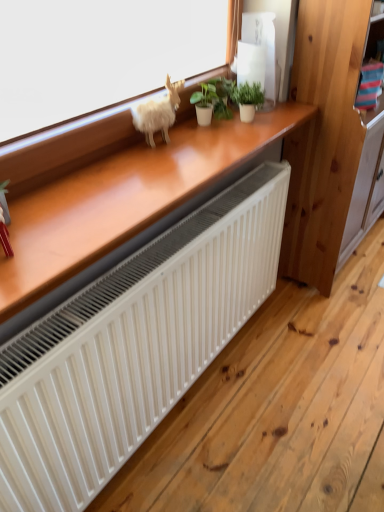
In order to face green matte plant at upper center, marked as the 2th houseplant in a left-to-right arrangement, should I rotate leftwards or rightwards?

Turn right by 7.481 degrees to look at green matte plant at upper center, marked as the 2th houseplant in a left-to-right arrangement.

This screenshot has height=512, width=384. I want to click on fuzzy white animal at upper center, so click(158, 113).

Image resolution: width=384 pixels, height=512 pixels. I want to click on green matte plant at center, arranged as the first houseplant when viewed from the left, so click(x=214, y=97).

In order to face wooden dresser at right, should I rotate leftwards or rightwards?

Rotate right and turn 21.163 degrees.

You are a GUI agent. You are given a task and a screenshot of the screen. Output one action in this format:
    pyautogui.click(x=<x>, y=<y>)
    Task: Click on the white matte radiator at lower center
    
    Given the screenshot: What is the action you would take?
    pyautogui.click(x=133, y=346)

How much distance is there between white matte radiator at lower center and green matte plant at center, arranged as the first houseplant when viewed from the left?

A distance of 26.35 inches exists between white matte radiator at lower center and green matte plant at center, arranged as the first houseplant when viewed from the left.

Would you say white matte radiator at lower center contains green matte plant at center, the second houseplant when ordered from right to left?

No, white matte radiator at lower center does not contain green matte plant at center, the second houseplant when ordered from right to left.

Is white matte radiator at lower center smaller than green matte plant at center, arranged as the first houseplant when viewed from the left?

No.

How different are the orientations of white matte radiator at lower center and green matte plant at center, arranged as the first houseplant when viewed from the left, in degrees?

There is a 0.506-degree angle between the facing directions of white matte radiator at lower center and green matte plant at center, arranged as the first houseplant when viewed from the left.

Which is more to the right, fuzzy white animal at upper center or green matte plant at upper center, marked as the 2th houseplant in a left-to-right arrangement?

green matte plant at upper center, marked as the 2th houseplant in a left-to-right arrangement, is more to the right.

Which is less distant, (169, 92) or (262, 98)?

Answer: Point (169, 92) is positioned closer to the camera compared to point (262, 98).

Is fuzzy white animal at upper center thinner than green matte plant at upper center, placed as the first houseplant when sorted from right to left?

Correct, the width of fuzzy white animal at upper center is less than that of green matte plant at upper center, placed as the first houseplant when sorted from right to left.

Considering the relative sizes of green matte plant at center, the second houseplant when ordered from right to left, and fuzzy white animal at upper center in the image provided, is green matte plant at center, the second houseplant when ordered from right to left, shorter than fuzzy white animal at upper center?

Yes, green matte plant at center, the second houseplant when ordered from right to left, is shorter than fuzzy white animal at upper center.

From a real-world perspective, does green matte plant at center, the second houseplant when ordered from right to left, stand above fuzzy white animal at upper center?

No, from a real-world perspective, green matte plant at center, the second houseplant when ordered from right to left, is not over fuzzy white animal at upper center

Would you say green matte plant at center, the second houseplant when ordered from right to left, is to the left or to the right of fuzzy white animal at upper center in the picture?

In the image, green matte plant at center, the second houseplant when ordered from right to left, appears on the right side of fuzzy white animal at upper center.

Is green matte plant at center, the second houseplant when ordered from right to left, directly adjacent to fuzzy white animal at upper center?

No, green matte plant at center, the second houseplant when ordered from right to left, is not beside fuzzy white animal at upper center.

Is green matte plant at upper center, placed as the first houseplant when sorted from right to left, positioned far away from white matte radiator at lower center?

green matte plant at upper center, placed as the first houseplant when sorted from right to left, is near white matte radiator at lower center, not far away.

Is white matte radiator at lower center surrounded by green matte plant at upper center, placed as the first houseplant when sorted from right to left?

No, white matte radiator at lower center is located outside of green matte plant at upper center, placed as the first houseplant when sorted from right to left.

From the image's perspective, does green matte plant at upper center, placed as the first houseplant when sorted from right to left, appear lower than white matte radiator at lower center?

No, from the image's perspective, green matte plant at upper center, placed as the first houseplant when sorted from right to left, is not beneath white matte radiator at lower center.

Considering the positions of objects green matte plant at upper center, marked as the 2th houseplant in a left-to-right arrangement, and white matte radiator at lower center in the image provided, who is behind, green matte plant at upper center, marked as the 2th houseplant in a left-to-right arrangement, or white matte radiator at lower center?

green matte plant at upper center, marked as the 2th houseplant in a left-to-right arrangement, is more distant.

From a real-world perspective, is green matte plant at center, arranged as the first houseplant when viewed from the left, on top of green matte plant at upper center, placed as the first houseplant when sorted from right to left?

No.

In terms of width, does green matte plant at center, the second houseplant when ordered from right to left, look wider or thinner when compared to green matte plant at upper center, placed as the first houseplant when sorted from right to left?

green matte plant at center, the second houseplant when ordered from right to left, is thinner than green matte plant at upper center, placed as the first houseplant when sorted from right to left.

Is green matte plant at center, arranged as the first houseplant when viewed from the left, bigger than green matte plant at upper center, marked as the 2th houseplant in a left-to-right arrangement?

Yes, green matte plant at center, arranged as the first houseplant when viewed from the left, is bigger than green matte plant at upper center, marked as the 2th houseplant in a left-to-right arrangement.

How many degrees apart are the facing directions of green matte plant at center, arranged as the first houseplant when viewed from the left, and green matte plant at upper center, marked as the 2th houseplant in a left-to-right arrangement?

The facing directions of green matte plant at center, arranged as the first houseplant when viewed from the left, and green matte plant at upper center, marked as the 2th houseplant in a left-to-right arrangement, are 0.000431 degrees apart.

Is fuzzy white animal at upper center completely or partially outside of green matte plant at center, arranged as the first houseplant when viewed from the left?

Yes, fuzzy white animal at upper center is located beyond the bounds of green matte plant at center, arranged as the first houseplant when viewed from the left.

Is point (164, 129) closer or farther from the camera than point (201, 125)?

Point (164, 129).

How many degrees apart are the facing directions of fuzzy white animal at upper center and green matte plant at center, the second houseplant when ordered from right to left?

They differ by 25.3 degrees in their facing directions.

Locate an element on the screen. animal positioned vertically above the green matte plant at center, arranged as the first houseplant when viewed from the left (from a real-world perspective) is located at coordinates (158, 113).

How different are the orientations of wooden dresser at right and green matte plant at upper center, placed as the first houseplant when sorted from right to left, in degrees?

The angle between the facing direction of wooden dresser at right and the facing direction of green matte plant at upper center, placed as the first houseplant when sorted from right to left, is 1.49 degrees.

Is wooden dresser at right aimed at green matte plant at upper center, placed as the first houseplant when sorted from right to left?

No, wooden dresser at right is not aimed at green matte plant at upper center, placed as the first houseplant when sorted from right to left.

Does wooden dresser at right have a lesser width compared to green matte plant at upper center, marked as the 2th houseplant in a left-to-right arrangement?

Incorrect, the width of wooden dresser at right is not less than that of green matte plant at upper center, marked as the 2th houseplant in a left-to-right arrangement.

Based on the photo, from the image's perspective, is wooden dresser at right below green matte plant at upper center, marked as the 2th houseplant in a left-to-right arrangement?

Incorrect, from the image's perspective, wooden dresser at right is higher than green matte plant at upper center, marked as the 2th houseplant in a left-to-right arrangement.

At what (x,y) coordinates should I click in order to perform the action: click on the 2nd houseplant counting from the left of the white matte radiator at lower center. Please return your answer as a coordinate pair (x, y). This screenshot has height=512, width=384. Looking at the image, I should click on (214, 97).

What are the coordinates of `animal below the green matte plant at upper center, placed as the first houseplant when sorted from right to left (from the image's perspective)` in the screenshot? It's located at (158, 113).

Considering their positions, is green matte plant at upper center, placed as the first houseplant when sorted from right to left, positioned further to white matte radiator at lower center than green matte plant at center, arranged as the first houseplant when viewed from the left?

Among the two, green matte plant at upper center, placed as the first houseplant when sorted from right to left, is located further to white matte radiator at lower center.

When comparing their distances from white matte radiator at lower center, does green matte plant at center, the second houseplant when ordered from right to left, or green matte plant at upper center, marked as the 2th houseplant in a left-to-right arrangement, seem closer?

A: green matte plant at center, the second houseplant when ordered from right to left, lies closer to white matte radiator at lower center than the other object.

From the image, which object appears to be nearer to green matte plant at upper center, marked as the 2th houseplant in a left-to-right arrangement, white matte radiator at lower center or fuzzy white animal at upper center?

fuzzy white animal at upper center is positioned closer to the anchor green matte plant at upper center, marked as the 2th houseplant in a left-to-right arrangement.

From the image, which object appears to be farther from white matte radiator at lower center, green matte plant at upper center, placed as the first houseplant when sorted from right to left, or wooden dresser at right?

Based on the image, green matte plant at upper center, placed as the first houseplant when sorted from right to left, appears to be further to white matte radiator at lower center.

Considering their positions, is green matte plant at upper center, placed as the first houseplant when sorted from right to left, positioned further to white matte radiator at lower center than fuzzy white animal at upper center?

Among the two, green matte plant at upper center, placed as the first houseplant when sorted from right to left, is located further to white matte radiator at lower center.

Considering their positions, is green matte plant at upper center, placed as the first houseplant when sorted from right to left, positioned closer to fuzzy white animal at upper center than green matte plant at center, arranged as the first houseplant when viewed from the left?

green matte plant at center, arranged as the first houseplant when viewed from the left, lies closer to fuzzy white animal at upper center than the other object.

Based on their spatial positions, is green matte plant at center, arranged as the first houseplant when viewed from the left, or wooden dresser at right further from green matte plant at upper center, marked as the 2th houseplant in a left-to-right arrangement?

wooden dresser at right.

From the image, which object appears to be farther from wooden dresser at right, fuzzy white animal at upper center or white matte radiator at lower center?

fuzzy white animal at upper center is positioned further to the anchor wooden dresser at right.

Identify the location of radiator situated between fuzzy white animal at upper center and wooden dresser at right from left to right. (133, 346).

This screenshot has height=512, width=384. I want to click on dresser between green matte plant at center, the second houseplant when ordered from right to left, and white matte radiator at lower center from top to bottom, so click(x=332, y=143).

Find the location of a particular element. The height and width of the screenshot is (512, 384). animal between green matte plant at upper center, marked as the 2th houseplant in a left-to-right arrangement, and white matte radiator at lower center, in the vertical direction is located at coordinates click(x=158, y=113).

I want to click on houseplant that lies between green matte plant at center, the second houseplant when ordered from right to left, and white matte radiator at lower center from top to bottom, so click(247, 99).